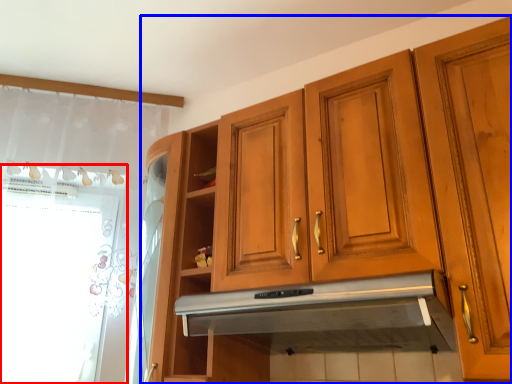
Question: Which of the following is the closest to the observer, window screen (highlighted by a red box) or cabinetry (highlighted by a blue box)?

Choices:
 (A) window screen
 (B) cabinetry

Answer: (B)